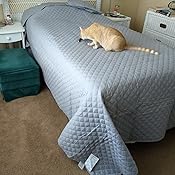
This screenshot has height=175, width=175. I want to click on brown capet, so click(28, 138).